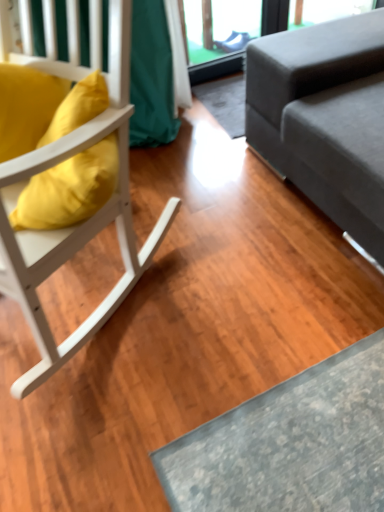
Question: Could you tell me if matte yellow pillow at left is facing white wood chair at left?

Choices:
 (A) no
 (B) yes

Answer: (B)

Question: Are matte yellow pillow at left and white wood chair at left far apart?

Choices:
 (A) yes
 (B) no

Answer: (B)

Question: Can you confirm if matte yellow pillow at left is bigger than white wood chair at left?

Choices:
 (A) yes
 (B) no

Answer: (B)

Question: Can you confirm if matte yellow pillow at left is shorter than white wood chair at left?

Choices:
 (A) yes
 (B) no

Answer: (A)

Question: From the image's perspective, is matte yellow pillow at left located above white wood chair at left?

Choices:
 (A) no
 (B) yes

Answer: (B)

Question: Considering the relative sizes of matte yellow pillow at left and white wood chair at left in the image provided, is matte yellow pillow at left wider than white wood chair at left?

Choices:
 (A) yes
 (B) no

Answer: (B)

Question: Is the surface of white wood chair at left in direct contact with matte yellow pillow at left?

Choices:
 (A) yes
 (B) no

Answer: (B)

Question: Is white wood chair at left turned away from matte yellow pillow at left?

Choices:
 (A) no
 (B) yes

Answer: (B)

Question: From the image's perspective, is white wood chair at left below matte yellow pillow at left?

Choices:
 (A) no
 (B) yes

Answer: (B)

Question: Considering the relative sizes of white wood chair at left and matte yellow pillow at left in the image provided, is white wood chair at left taller than matte yellow pillow at left?

Choices:
 (A) no
 (B) yes

Answer: (B)

Question: Can you confirm if white wood chair at left is shorter than matte yellow pillow at left?

Choices:
 (A) yes
 (B) no

Answer: (B)

Question: From a real-world perspective, is white wood chair at left positioned over matte yellow pillow at left based on gravity?

Choices:
 (A) yes
 (B) no

Answer: (B)

Question: Are gray fabric couch at right and matte yellow pillow at left far apart?

Choices:
 (A) yes
 (B) no

Answer: (B)